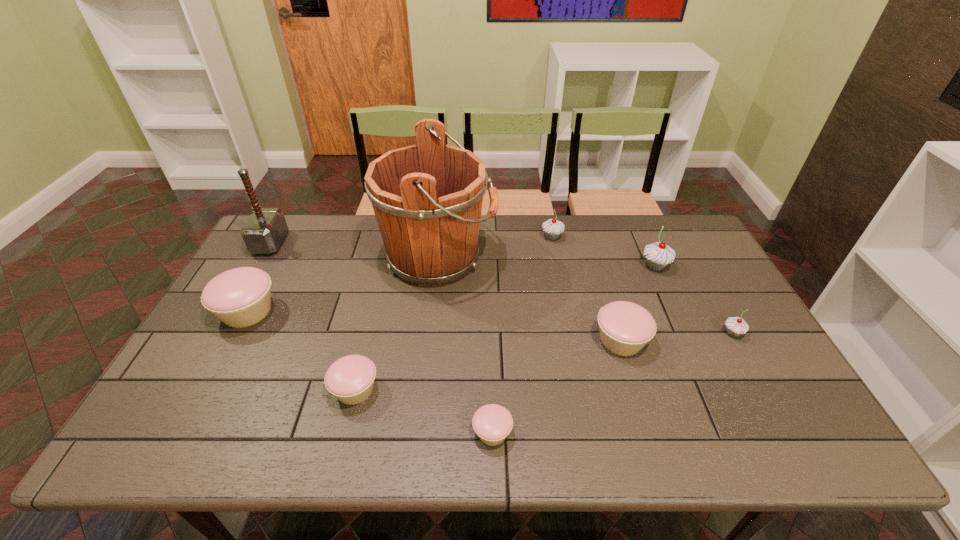
The image size is (960, 540). I want to click on bucket, so 427,198.

The image size is (960, 540). Find the location of `brown hammer`. brown hammer is located at coordinates (264, 231).

Find the location of a particular element. This screenshot has height=540, width=960. the second tallest object is located at coordinates (264, 231).

Image resolution: width=960 pixels, height=540 pixels. What are the coordinates of `the second nearest gray cupcake` in the screenshot? It's located at (658, 255).

Image resolution: width=960 pixels, height=540 pixels. I want to click on the second gray cupcake from right to left, so click(x=658, y=255).

Identify the location of the second biggest gray cupcake. Image resolution: width=960 pixels, height=540 pixels. (553, 228).

Find the location of a particular element. Image resolution: width=960 pixels, height=540 pixels. the farthest cupcake is located at coordinates (553, 228).

What are the coordinates of `the biggest pink cupcake` in the screenshot? It's located at (240, 297).

This screenshot has width=960, height=540. Identify the location of the leftmost pink cupcake. (240, 297).

This screenshot has height=540, width=960. In order to click on the third object from right to left in this screenshot , I will do `click(625, 328)`.